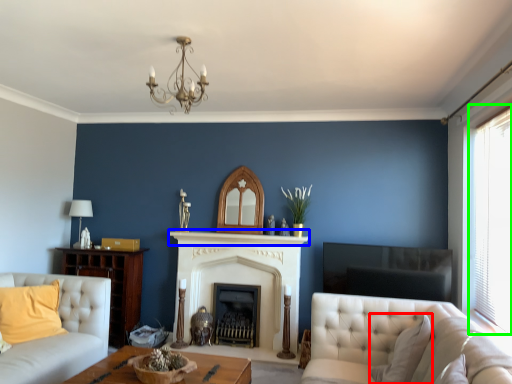
Question: Based on their relative distances, which object is farther from pillow (highlighted by a red box)? Choose from mantle (highlighted by a blue box) and window (highlighted by a green box).

Choices:
 (A) mantle
 (B) window

Answer: (A)